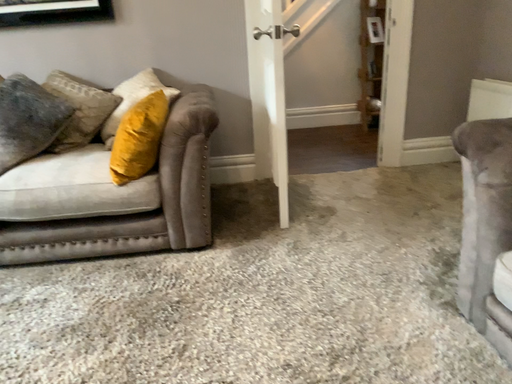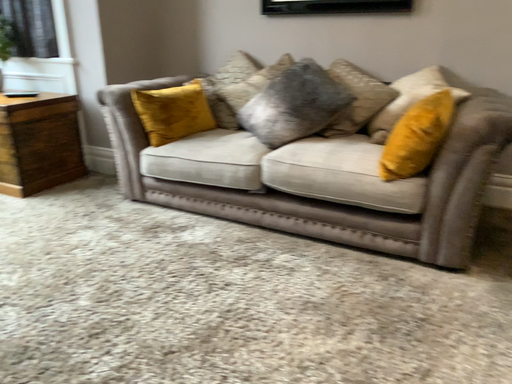
Question: Which way did the camera rotate in the video?

Choices:
 (A) rotated right
 (B) rotated left

Answer: (B)